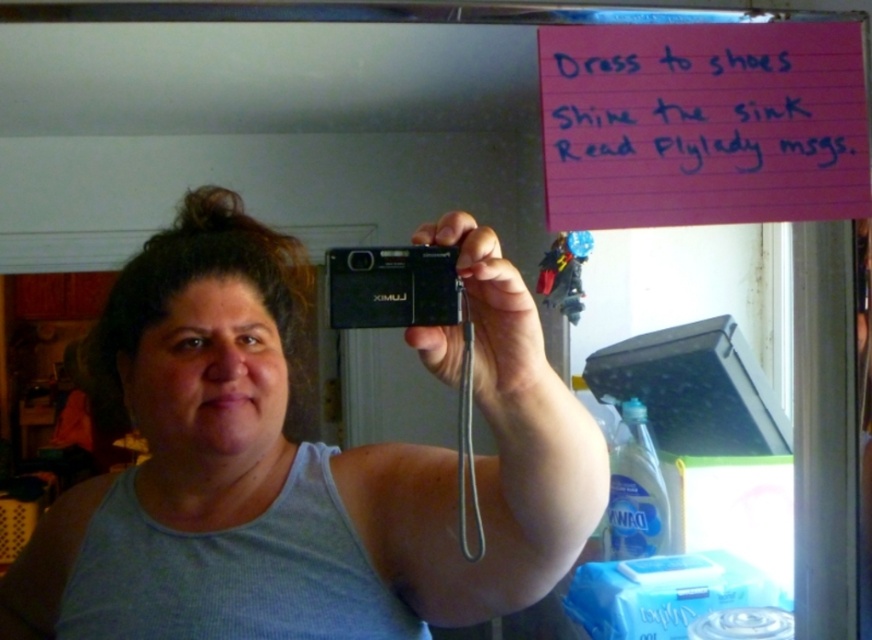
You are standing in the bathroom and want to reach the point marked at coordinates point (101, 541). If your arm can extend 30 inches, can you reach it without moving closer?

The distance between you and point (101, 541) is 33.42 inches, which is beyond your arm extension of 30 inches. You cannot reach it without moving closer.

You are organizing the items on the mirror in the bathroom. The pink paper at upper right and the black plastic camera at upper center are both on the mirror. Which item takes up more space on the mirror?

The pink paper at upper right is larger in size than the black plastic camera at upper center, so it takes up more space on the mirror.

You are organizing a photography exhibition and need to display two cameras side by side. The matte black camera at upper center and the black plastic camera at upper center are both candidates. If you want to place the larger camera on the left side of the display, which camera should you choose?

The matte black camera at upper center has a larger size compared to the black plastic camera at upper center, so you should choose the matte black camera at upper center to place on the left side of the display.